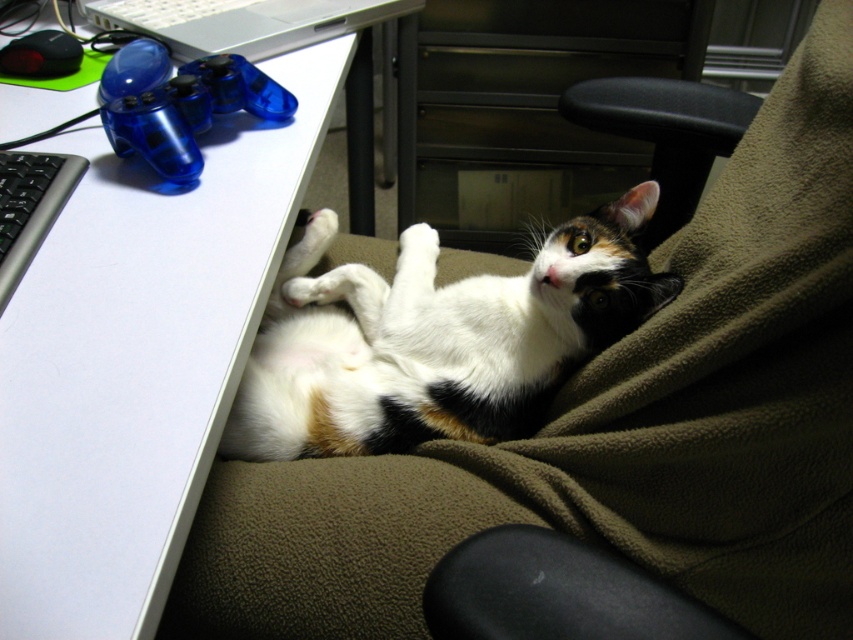
What are the coordinates of the calico fur cat at lower right in the image?

The calico fur cat at lower right is located at coordinates point (434, 339).

You are a small toy mouse that is 3 inches tall. You want to roll from the white plastic computer desk at lower left to the calico fur cat at lower right. Can you fit under the desk without being seen by the cat?

Answer: The white plastic computer desk at lower left has a greater height compared to the calico fur cat at lower right. Since the desk is taller than the cat, the toy mouse can likely fit under the desk and remain unseen by the cat as long as it stays below the desk surface.

You are a photographer taking a picture of the calico fur cat at lower right and the white plastic computer desk at lower left. Which object is positioned closer to the camera?

The white plastic computer desk at lower left is closer to the viewer than the calico fur cat at lower right, so it will appear closer to the camera in the photo.